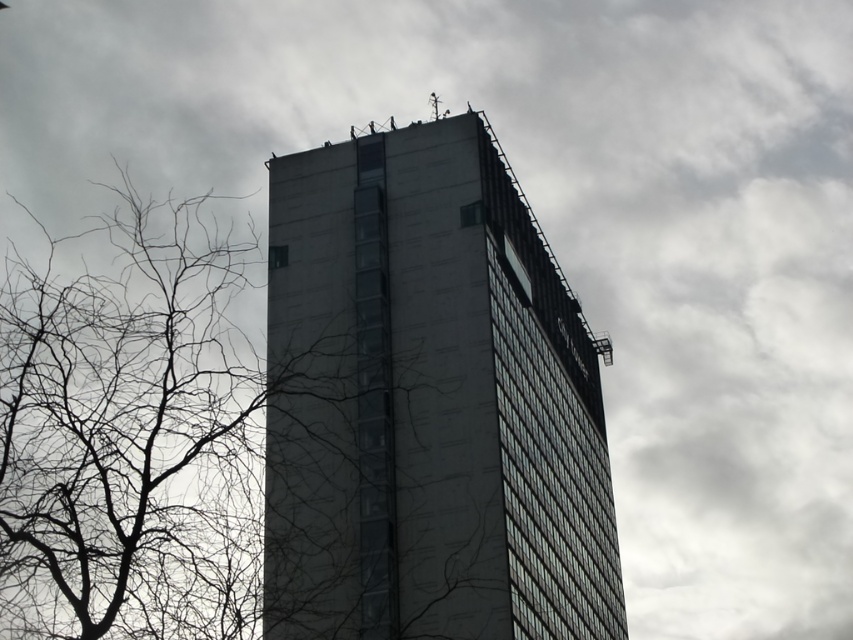
Question: Does dark gray concrete building at center come in front of bare branches at left?

Choices:
 (A) yes
 (B) no

Answer: (B)

Question: Can you confirm if dark gray concrete building at center is positioned below bare branches at left?

Choices:
 (A) no
 (B) yes

Answer: (B)

Question: Among these objects, which one is farthest from the camera?

Choices:
 (A) bare branches at left
 (B) dark gray concrete building at center

Answer: (B)

Question: Which point is closer to the camera taking this photo?

Choices:
 (A) (x=476, y=179)
 (B) (x=248, y=524)

Answer: (A)

Question: In this image, where is dark gray concrete building at center located relative to bare branches at left?

Choices:
 (A) above
 (B) below

Answer: (B)